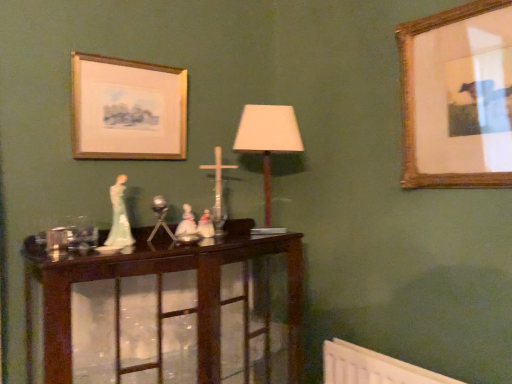
Question: Does white porcelain figurines at center have a greater height compared to wooden picture frame at upper left, arranged as the 1th picture frame when viewed from the left?

Choices:
 (A) yes
 (B) no

Answer: (B)

Question: From a real-world perspective, is white porcelain figurines at center positioned over wooden picture frame at upper left, arranged as the 1th picture frame when viewed from the left, based on gravity?

Choices:
 (A) yes
 (B) no

Answer: (B)

Question: Can wooden picture frame at upper left, arranged as the 1th picture frame when viewed from the left, be found inside white porcelain figurines at center?

Choices:
 (A) yes
 (B) no

Answer: (B)

Question: Considering the relative positions of white porcelain figurines at center and wooden picture frame at upper left, the 2th picture frame viewed from the right, in the image provided, is white porcelain figurines at center behind wooden picture frame at upper left, the 2th picture frame viewed from the right,?

Choices:
 (A) yes
 (B) no

Answer: (A)

Question: Is white porcelain figurines at center positioned beyond the bounds of wooden picture frame at upper left, the 2th picture frame viewed from the right?

Choices:
 (A) no
 (B) yes

Answer: (B)

Question: From a real-world perspective, is white porcelain figurines at center beneath wooden picture frame at upper left, the 2th picture frame viewed from the right?

Choices:
 (A) no
 (B) yes

Answer: (B)

Question: Does matte white shade at center have a lesser height compared to white porcelain figurines at center?

Choices:
 (A) no
 (B) yes

Answer: (A)

Question: Is white porcelain figurines at center at the back of matte white shade at center?

Choices:
 (A) no
 (B) yes

Answer: (A)

Question: Can you confirm if matte white shade at center is taller than white porcelain figurines at center?

Choices:
 (A) yes
 (B) no

Answer: (A)

Question: Would you say matte white shade at center contains white porcelain figurines at center?

Choices:
 (A) yes
 (B) no

Answer: (B)

Question: Can you confirm if matte white shade at center is smaller than white porcelain figurines at center?

Choices:
 (A) no
 (B) yes

Answer: (A)

Question: Considering the relative positions of matte white shade at center and white porcelain figurines at center in the image provided, is matte white shade at center to the left of white porcelain figurines at center from the viewer's perspective?

Choices:
 (A) no
 (B) yes

Answer: (A)

Question: From a real-world perspective, is white porcelain figurines at center below wooden picture frame at upper right, which is the 1th picture frame in right-to-left order?

Choices:
 (A) no
 (B) yes

Answer: (B)